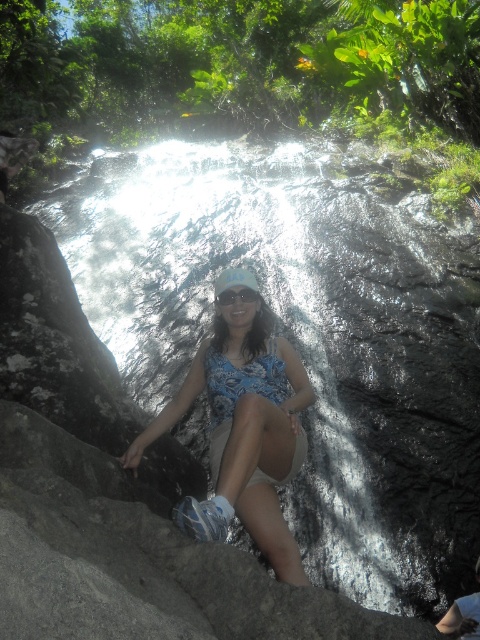
Question: Does clear water at center appear on the left side of blue floral dress at center?

Choices:
 (A) yes
 (B) no

Answer: (B)

Question: From the image, what is the correct spatial relationship of clear water at center in relation to blue floral dress at center?

Choices:
 (A) left
 (B) right

Answer: (B)

Question: Among these objects, which one is farthest from the camera?

Choices:
 (A) clear water at center
 (B) transparent plastic goggles at center

Answer: (B)

Question: Does clear water at center have a smaller size compared to blue floral dress at center?

Choices:
 (A) no
 (B) yes

Answer: (A)

Question: Which object appears closest to the camera in this image?

Choices:
 (A) transparent plastic goggles at center
 (B) clear water at center

Answer: (B)

Question: Which point is farther from the camera taking this photo?

Choices:
 (A) (360, 257)
 (B) (228, 387)

Answer: (A)